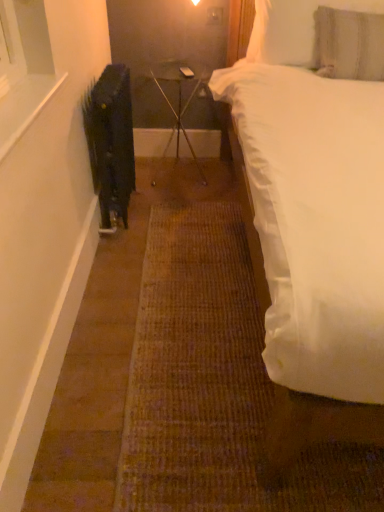
Measure the distance between point [311,124] and camera.

Point [311,124] and camera are 1.35 meters apart.

Looking at this image, in order to face white soft pillow at upper right, the 2th pillow positioned from the bottom, should I rotate leftwards or rightwards?

You should rotate right by 17.548 degrees.

What do you see at coordinates (179, 96) in the screenshot? I see `clear glass table at center` at bounding box center [179, 96].

At what (x,y) coordinates should I click in order to perform the action: click on black matte radiator at left. Please return your answer as a coordinate pair (x, y). The height and width of the screenshot is (512, 384). Looking at the image, I should click on (111, 141).

From the picture: Is white soft pillow at upper right, placed as the 1th pillow when sorted from top to bottom, taller or shorter than textured gray pillow at upper right, which is the first pillow in bottom-to-top order?

white soft pillow at upper right, placed as the 1th pillow when sorted from top to bottom, is shorter than textured gray pillow at upper right, which is the first pillow in bottom-to-top order.

Which object is thinner, white soft pillow at upper right, placed as the 1th pillow when sorted from top to bottom, or textured gray pillow at upper right, the 2th pillow when ordered from top to bottom?

white soft pillow at upper right, placed as the 1th pillow when sorted from top to bottom, is thinner.

Which object is closer to the camera taking this photo, white soft pillow at upper right, placed as the 1th pillow when sorted from top to bottom, or textured gray pillow at upper right, the 2th pillow when ordered from top to bottom?

textured gray pillow at upper right, the 2th pillow when ordered from top to bottom, is more forward.

Looking at this image, which of these two, white soft pillow at upper right, the 2th pillow positioned from the bottom, or textured gray pillow at upper right, the 2th pillow when ordered from top to bottom, is smaller?

white soft pillow at upper right, the 2th pillow positioned from the bottom.

Which of these two, black matte radiator at left or white soft bed at right, is wider?

white soft bed at right is wider.

Between black matte radiator at left and white soft bed at right, which one has less height?

Standing shorter between the two is black matte radiator at left.

Between black matte radiator at left and white soft bed at right, which one has larger size?

white soft bed at right is bigger.

Considering the relative positions of black matte radiator at left and white soft bed at right in the image provided, is black matte radiator at left in front of white soft bed at right?

No.

Based on the photo, from a real-world perspective, which is physically below, clear glass table at center or white soft bed at right?

clear glass table at center.

Between clear glass table at center and white soft bed at right, which one has larger width?

With larger width is white soft bed at right.

Between clear glass table at center and white soft bed at right, which one has smaller size?

clear glass table at center.

Is clear glass table at center positioned behind white soft bed at right?

Yes, clear glass table at center is further from the camera.

Does point (178, 143) come closer to viewer compared to point (373, 53)?

No, (178, 143) is behind (373, 53).

Can you confirm if clear glass table at center is smaller than textured gray pillow at upper right, the 2th pillow when ordered from top to bottom?

Incorrect, clear glass table at center is not smaller in size than textured gray pillow at upper right, the 2th pillow when ordered from top to bottom.

Is clear glass table at center wider than textured gray pillow at upper right, which is the first pillow in bottom-to-top order?

Yes.

Based on their positions, is clear glass table at center located to the left or right of textured gray pillow at upper right, which is the first pillow in bottom-to-top order?

clear glass table at center is to the left of textured gray pillow at upper right, which is the first pillow in bottom-to-top order.

Is black matte radiator at left positioned with its back to white soft pillow at upper right, placed as the 1th pillow when sorted from top to bottom?

→ No, white soft pillow at upper right, placed as the 1th pillow when sorted from top to bottom, is not at the back of black matte radiator at left.

In the image, is black matte radiator at left positioned in front of or behind white soft pillow at upper right, the 2th pillow positioned from the bottom?

Clearly, black matte radiator at left is in front of white soft pillow at upper right, the 2th pillow positioned from the bottom.

Is black matte radiator at left inside or outside of white soft pillow at upper right, the 2th pillow positioned from the bottom?

black matte radiator at left cannot be found inside white soft pillow at upper right, the 2th pillow positioned from the bottom.

Is black matte radiator at left placed right next to white soft pillow at upper right, placed as the 1th pillow when sorted from top to bottom?

black matte radiator at left and white soft pillow at upper right, placed as the 1th pillow when sorted from top to bottom, are clearly separated.

Are textured gray pillow at upper right, which is the first pillow in bottom-to-top order, and black matte radiator at left located far from each other?

Yes, textured gray pillow at upper right, which is the first pillow in bottom-to-top order, is far from black matte radiator at left.

Consider the image. Is textured gray pillow at upper right, which is the first pillow in bottom-to-top order, situated inside black matte radiator at left or outside?

The correct answer is: outside.

Considering the sizes of objects textured gray pillow at upper right, the 2th pillow when ordered from top to bottom, and black matte radiator at left in the image provided, who is thinner, textured gray pillow at upper right, the 2th pillow when ordered from top to bottom, or black matte radiator at left?

black matte radiator at left is thinner.

From the image's perspective, is textured gray pillow at upper right, which is the first pillow in bottom-to-top order, below black matte radiator at left?

Incorrect, from the image's perspective, textured gray pillow at upper right, which is the first pillow in bottom-to-top order, is higher than black matte radiator at left.

Is textured gray pillow at upper right, the 2th pillow when ordered from top to bottom, smaller than clear glass table at center?

Yes.

From the image's perspective, which is above, textured gray pillow at upper right, the 2th pillow when ordered from top to bottom, or clear glass table at center?

textured gray pillow at upper right, the 2th pillow when ordered from top to bottom.

Does point (377, 60) come in front of point (196, 77)?

Yes, it is in front of point (196, 77).

Can you tell me how much textured gray pillow at upper right, the 2th pillow when ordered from top to bottom, and clear glass table at center differ in facing direction?

The facing directions of textured gray pillow at upper right, the 2th pillow when ordered from top to bottom, and clear glass table at center are 7.19 degrees apart.

At what (x,y) coordinates should I click in order to perform the action: click on pillow above the textured gray pillow at upper right, which is the first pillow in bottom-to-top order (from a real-world perspective). Please return your answer as a coordinate pair (x, y). Looking at the image, I should click on (294, 29).

At what (x,y) coordinates should I click in order to perform the action: click on radiator that is under the white soft bed at right (from a real-world perspective). Please return your answer as a coordinate pair (x, y). Image resolution: width=384 pixels, height=512 pixels. Looking at the image, I should click on (111, 141).

Considering their positions, is white soft bed at right positioned further to clear glass table at center than textured gray pillow at upper right, which is the first pillow in bottom-to-top order?

white soft bed at right is positioned further to the anchor clear glass table at center.

From the image, which object appears to be farther from textured gray pillow at upper right, the 2th pillow when ordered from top to bottom, clear glass table at center or black matte radiator at left?

black matte radiator at left lies further to textured gray pillow at upper right, the 2th pillow when ordered from top to bottom, than the other object.

Consider the image. Based on their spatial positions, is textured gray pillow at upper right, the 2th pillow when ordered from top to bottom, or white soft bed at right further from clear glass table at center?

white soft bed at right.

Based on their spatial positions, is white soft pillow at upper right, the 2th pillow positioned from the bottom, or clear glass table at center closer to textured gray pillow at upper right, which is the first pillow in bottom-to-top order?

Based on the image, white soft pillow at upper right, the 2th pillow positioned from the bottom, appears to be nearer to textured gray pillow at upper right, which is the first pillow in bottom-to-top order.

Consider the image. Based on their spatial positions, is white soft pillow at upper right, the 2th pillow positioned from the bottom, or black matte radiator at left further from textured gray pillow at upper right, which is the first pillow in bottom-to-top order?

Based on the image, black matte radiator at left appears to be further to textured gray pillow at upper right, which is the first pillow in bottom-to-top order.

Based on the photo, considering their positions, is white soft bed at right positioned further to black matte radiator at left than clear glass table at center?

white soft bed at right is further to black matte radiator at left.

From the image, which object appears to be farther from clear glass table at center, black matte radiator at left or white soft pillow at upper right, placed as the 1th pillow when sorted from top to bottom?

black matte radiator at left.

Considering their positions, is black matte radiator at left positioned further to white soft pillow at upper right, placed as the 1th pillow when sorted from top to bottom, than clear glass table at center?

The object further to white soft pillow at upper right, placed as the 1th pillow when sorted from top to bottom, is black matte radiator at left.

What are the coordinates of `table between black matte radiator at left and textured gray pillow at upper right, which is the first pillow in bottom-to-top order, from left to right` in the screenshot? It's located at (179, 96).

The height and width of the screenshot is (512, 384). What are the coordinates of `radiator positioned between white soft bed at right and white soft pillow at upper right, placed as the 1th pillow when sorted from top to bottom, from near to far` in the screenshot? It's located at (111, 141).

Image resolution: width=384 pixels, height=512 pixels. I want to click on radiator located between white soft bed at right and textured gray pillow at upper right, which is the first pillow in bottom-to-top order, in the depth direction, so click(111, 141).

This screenshot has width=384, height=512. Find the location of `pillow between white soft bed at right and white soft pillow at upper right, placed as the 1th pillow when sorted from top to bottom, along the z-axis`. pillow between white soft bed at right and white soft pillow at upper right, placed as the 1th pillow when sorted from top to bottom, along the z-axis is located at coordinates (349, 44).